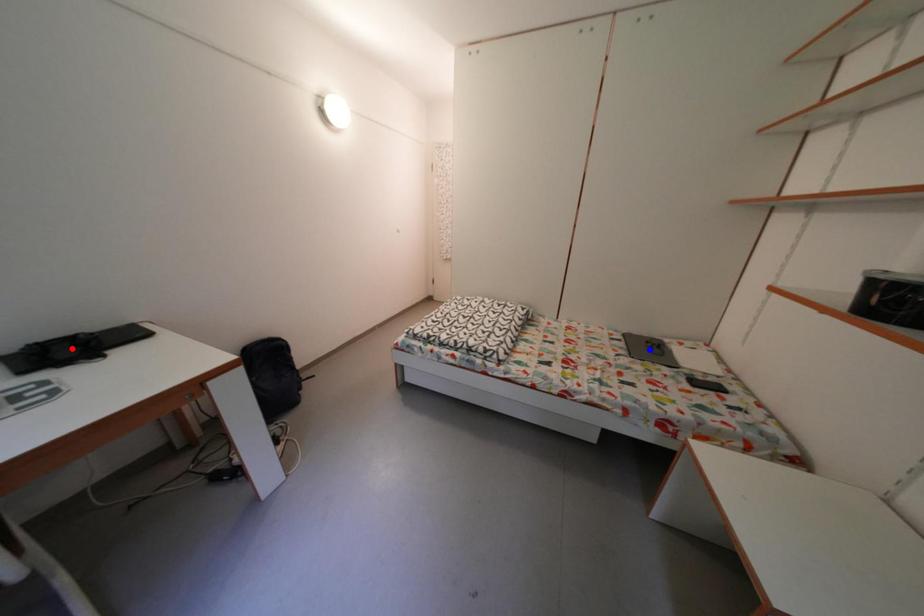
Question: In the image, two points are highlighted. Which point is nearer to the camera? Reply with the corresponding letter.

Choices:
 (A) blue point
 (B) red point

Answer: (B)